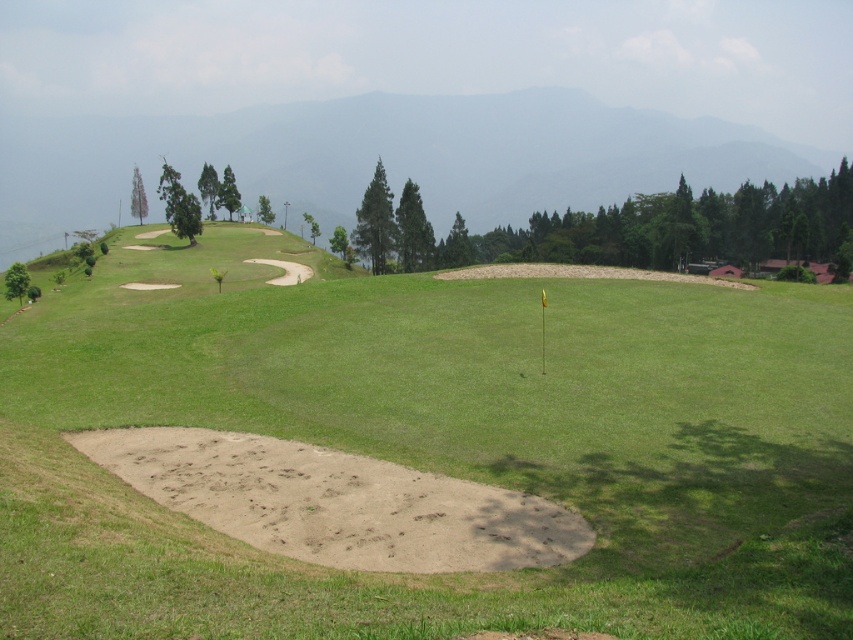
Consider the image. You are a golfer standing at the tee, ready to hit your ball. You want to know if you can see the smooth sand trap at center clearly from your current position. The flag is 10 meters away. Can you see it?

The smooth sand trap at center is 6.24 meters away from you, which is closer than the flag at 10 meters. Since it is within your line of sight and distance, you can see the smooth sand trap at center clearly from your current position.

You are a golfer standing on the fairway and see the smooth sand trap at center and the green grassy hillside at upper center. Which object is positioned to the left side of the other?

The smooth sand trap at center is to the left of green grassy hillside at upper center.

You are a golfer standing on the fairway and see the smooth sand trap at center and the green grassy hillside at upper center. Which object is closer to you?

The smooth sand trap at center is closer to you because it is in front of the green grassy hillside at upper center, meaning it is positioned nearer to your viewpoint.